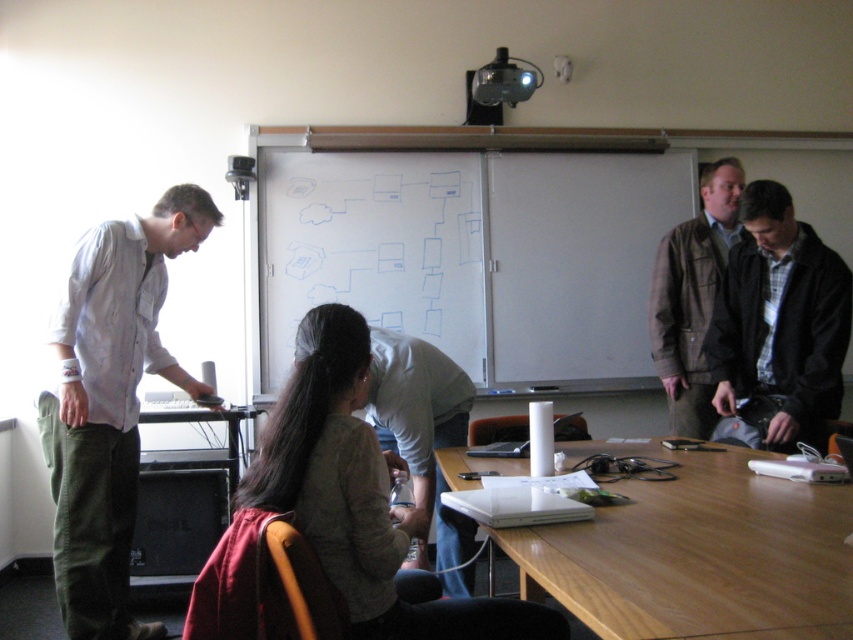
Is point (648, 625) farther from camera compared to point (514, 81)?

No, (648, 625) is closer to viewer.

Is wooden table at lower right above black plastic projector at upper center?

No.

Between point (451, 458) and point (500, 83), which one is positioned behind?

Positioned behind is point (500, 83).

Where is `wooden table at lower right`? The width and height of the screenshot is (853, 640). wooden table at lower right is located at coordinates (697, 554).

Does light brown fabric jacket at center have a smaller size compared to black plastic projector at upper center?

No.

Which of these two, light brown fabric jacket at center or black plastic projector at upper center, stands taller?

light brown fabric jacket at center is taller.

Find the location of a particular element. The image size is (853, 640). light brown fabric jacket at center is located at coordinates (363, 499).

Is light gray shirt at left wider than black plastic projector at upper center?

Yes.

Does point (67, 330) come farther from viewer compared to point (503, 72)?

That is False.

What do you see at coordinates (109, 403) in the screenshot? Image resolution: width=853 pixels, height=640 pixels. I see `light gray shirt at left` at bounding box center [109, 403].

This screenshot has width=853, height=640. In order to click on light gray shirt at left in this screenshot , I will do `click(109, 403)`.